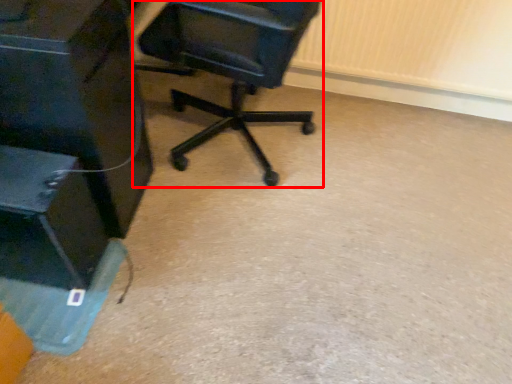
Question: In this image, where is chair (annotated by the red box) located relative to furniture?

Choices:
 (A) right
 (B) left

Answer: (A)